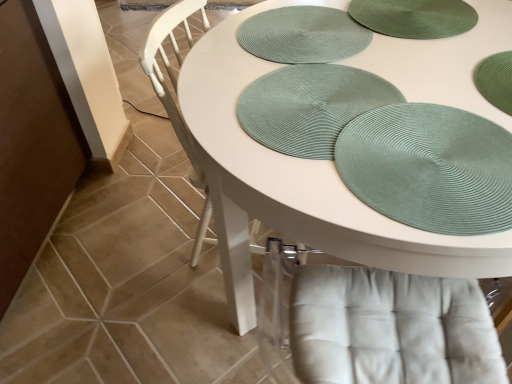
Question: Considering their positions, is green textured placemat at upper right located in front of or behind green woven placemat at center, the 2th platter positioned from the back?

Choices:
 (A) behind
 (B) front

Answer: (B)

Question: Looking at their shapes, would you say green textured placemat at upper right is wider or thinner than green woven placemat at center, placed as the first platter when sorted from front to back?

Choices:
 (A) wide
 (B) thin

Answer: (B)

Question: Considering the real-world distances, which object is farthest from the white matte table at center?

Choices:
 (A) green textured placemat at upper right
 (B) white textured chair at center
 (C) green woven placemat at center, placed as the first platter when sorted from front to back
 (D) green textured placemat at upper center, placed as the 1th platter when sorted from back to front

Answer: (B)

Question: Which object is the closest to the white matte table at center?

Choices:
 (A) green textured placemat at upper right
 (B) white textured chair at center
 (C) green woven placemat at center, placed as the first platter when sorted from front to back
 (D) green textured placemat at upper center, placed as the 1th platter when sorted from back to front

Answer: (C)